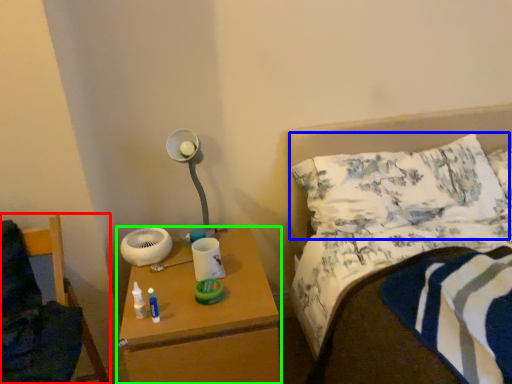
Question: Based on their relative distances, which object is nearer to furniture (highlighted by a red box)? Choose from pillow (highlighted by a blue box) and nightstand (highlighted by a green box).

Choices:
 (A) pillow
 (B) nightstand

Answer: (B)